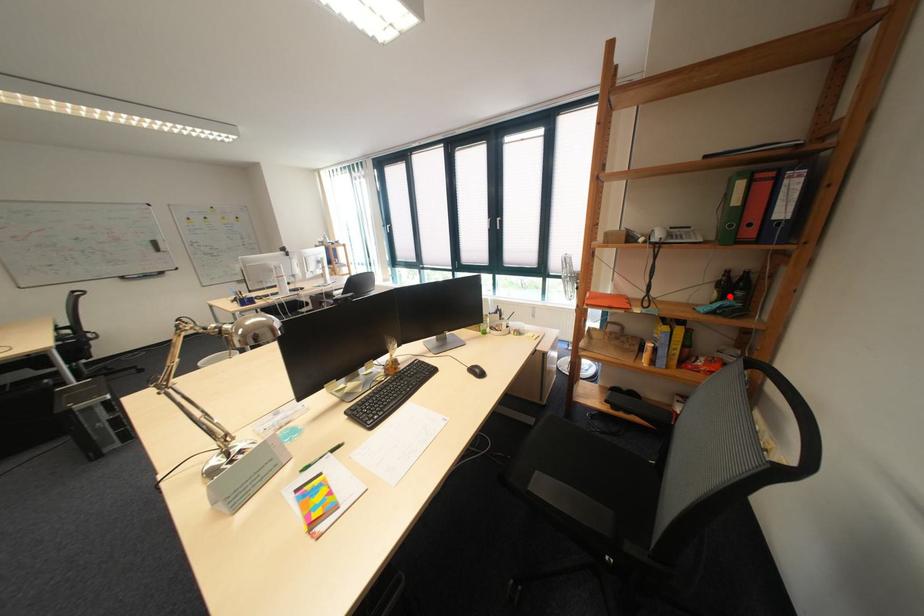
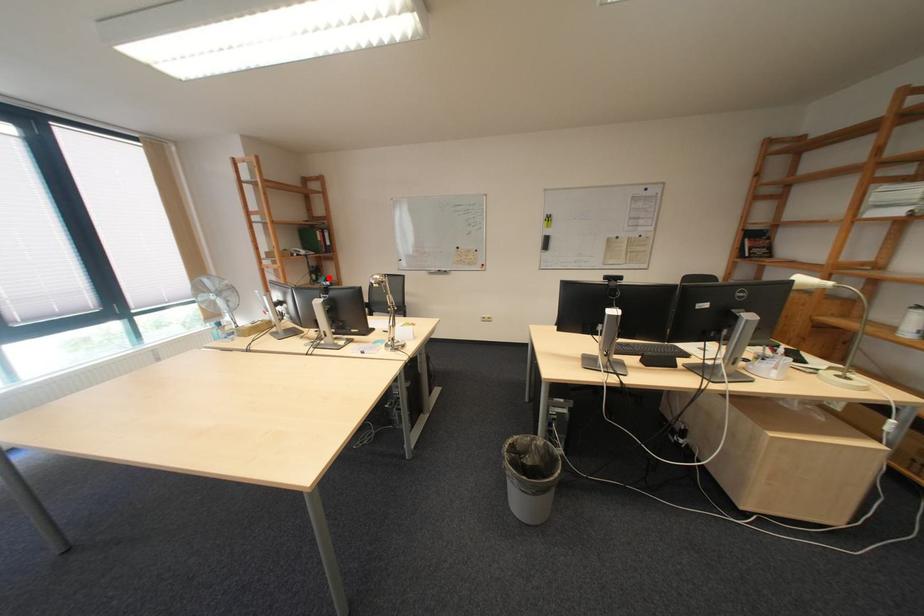
I am providing you with two images of the same scene from different viewpoints. A red point is marked on the first image and another point is marked on the second image. Is the marked point in image1 the same physical position as the marked point in image2?

Yes